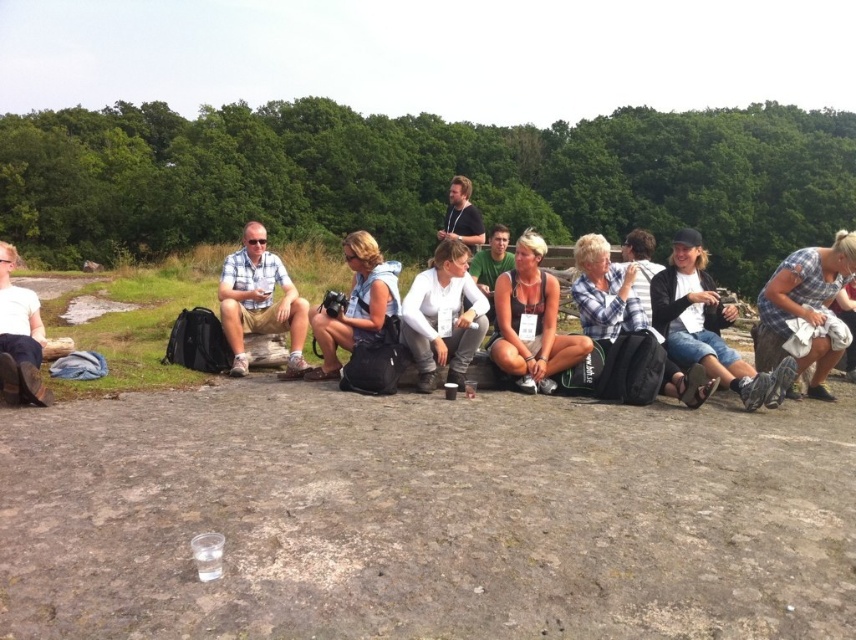
You are a photographer trying to capture a candid shot of the group. You notice the denim shorts at center and the matte black boots at lower left. Which object is positioned more to the right side of the image?

The denim shorts at center are positioned to the right of the matte black boots at lower left, so the denim shorts at center are more to the right side of the image.

You are a photographer trying to capture a candid shot of the group. You notice two people wearing shirts of different colors at the center of the scene. Which person is positioned lower in the frame between the white matte shirt at center and the dark blue shirt at center?

The white matte shirt at center is positioned lower than the dark blue shirt at center in the frame.